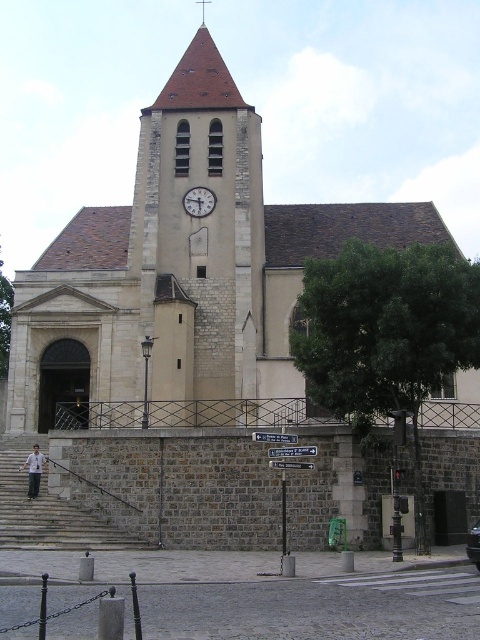
You are standing at the camera position and want to take a photo of the beige stone clock tower at center. If your camera can focus on objects up to 200 feet away, will you be able to capture the tower clearly?

The beige stone clock tower at center and camera are 175.90 feet apart from each other. Since 175.90 feet is less than 200 feet, the camera can focus on the tower, so yes, you can capture it clearly.